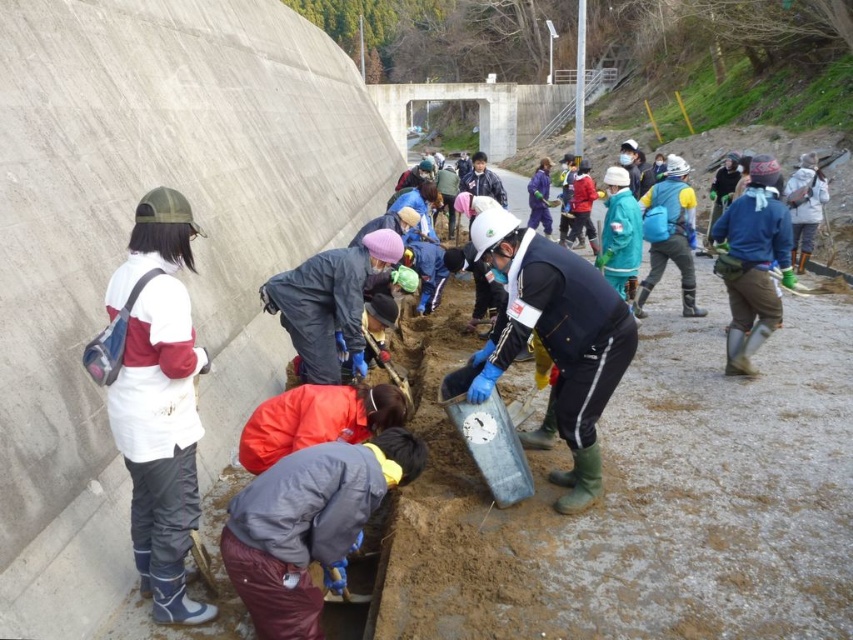
You are a safety inspector checking the construction site. You notice the smooth concrete at left and the white hard hat at center. Which object is higher in elevation?

The smooth concrete at left is taller than the white hard hat at center, so the smooth concrete at left is higher in elevation.

You are a safety inspector standing at the center of the scene. You need to ensure that the white matte jacket at left is at least 15 feet away from the smooth concrete at left to comply with safety regulations. Based on the scene description, is the current distance compliant?

The smooth concrete at left and the white matte jacket at left are 14.01 feet apart from each other. Since 14.01 feet is less than the required 15 feet, the current distance does not comply with the safety regulations.